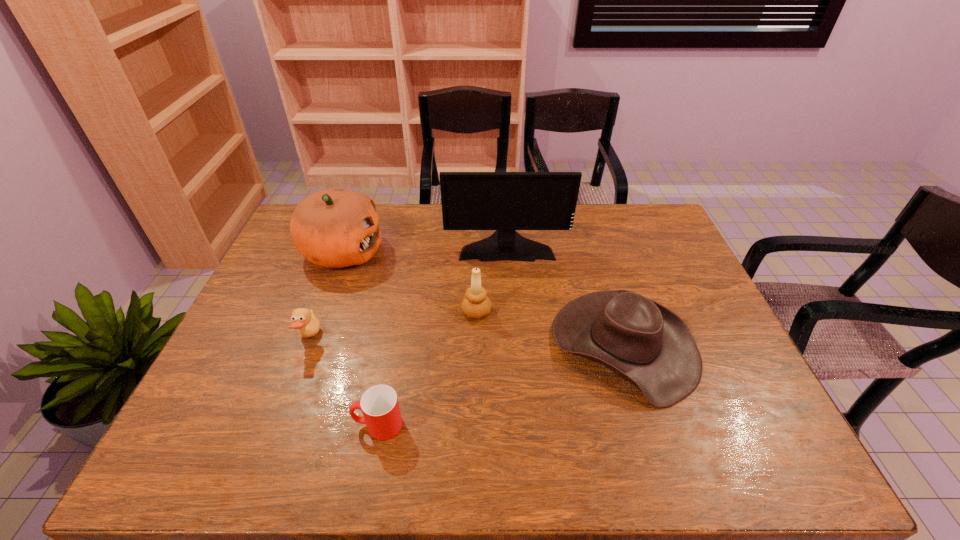
Where is `the tallest object`? the tallest object is located at coordinates [x=503, y=201].

Where is `the fifth shortest object`? the fifth shortest object is located at coordinates (333, 228).

Locate an element on the screen. The width and height of the screenshot is (960, 540). the fourth shortest object is located at coordinates (475, 304).

Find the location of a particular element. Image resolution: width=960 pixels, height=540 pixels. cowboy hat is located at coordinates (645, 343).

Locate an element on the screen. duck is located at coordinates (304, 320).

Where is `the nearest object`? The height and width of the screenshot is (540, 960). the nearest object is located at coordinates (379, 404).

The width and height of the screenshot is (960, 540). I want to click on cup, so click(379, 404).

This screenshot has width=960, height=540. Find the location of `free region located 0.080m on the screen side of the tallest object`. free region located 0.080m on the screen side of the tallest object is located at coordinates (509, 278).

Identify the location of vacant space situated on the face of the fifth shortest object. (410, 252).

The image size is (960, 540). I want to click on vacant space positioned 0.300m on the back of the candle_holder, so click(x=477, y=239).